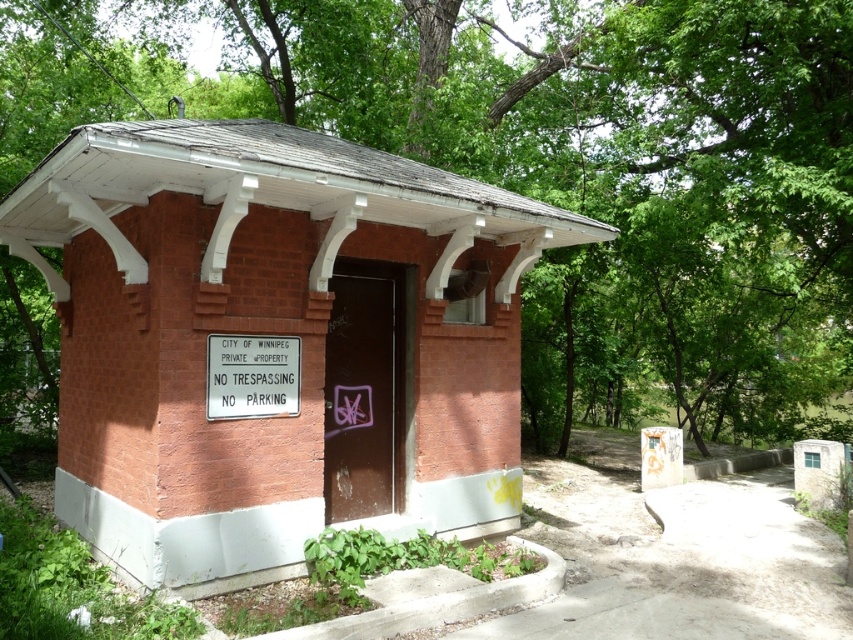
You are a city inspector evaluating the property. You notice the brick hut at center and the white plastic sign at center. Based on the structure, which object is wider?

The brick hut at center is wider than the white plastic sign at center.